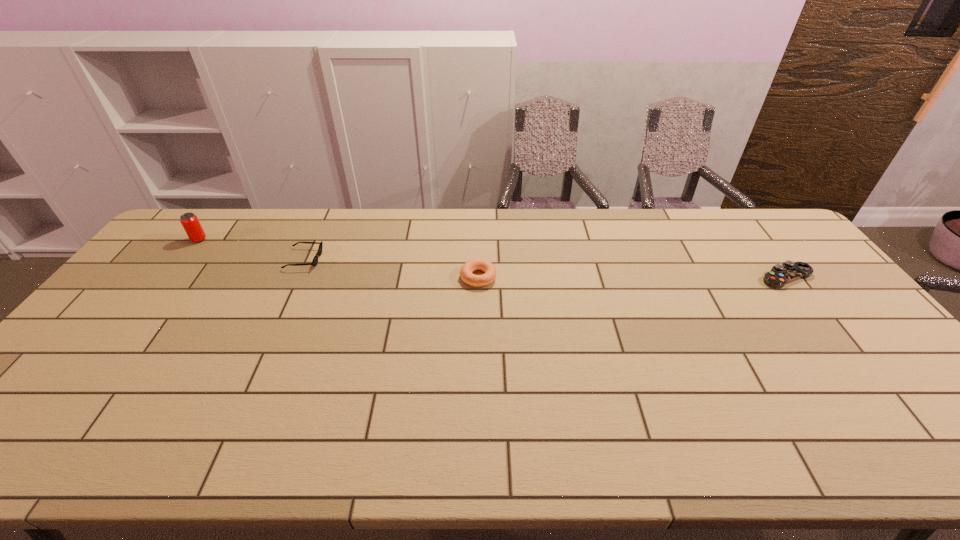
The height and width of the screenshot is (540, 960). What are the coordinates of `vacant point that satisfies the following two spatial constraints: 1. on the front side of the third object from left to right; 2. on the left side of the rightmost object` in the screenshot? It's located at (478, 278).